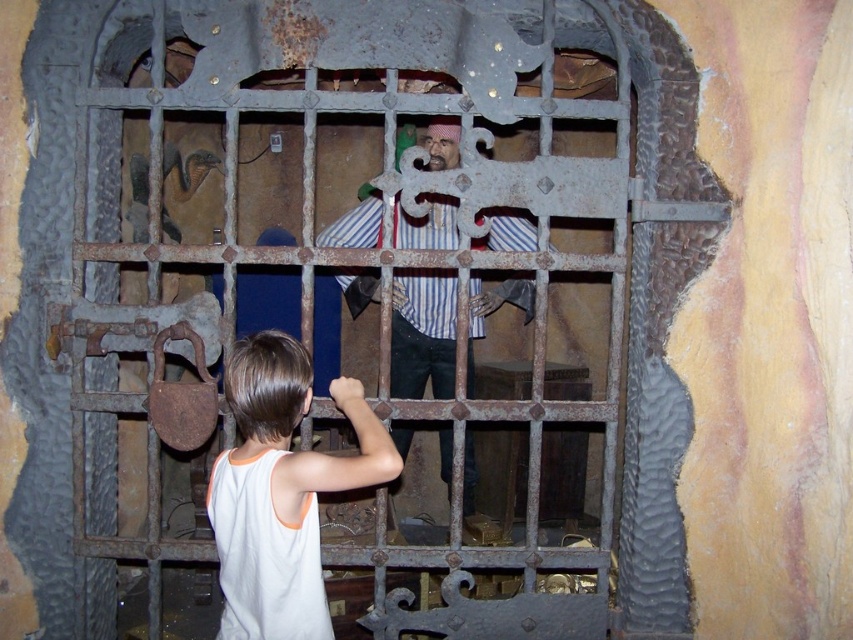
You are a costume designer preparing for a play. You need to place the white cotton tank top at lower left and the striped fabric pirate at center in a display. Based on the scene, which item should be placed lower to avoid blocking the view of the other?

The white cotton tank top at lower left should be placed lower because it is positioned under the striped fabric pirate at center, ensuring it doesn

You are a visitor at this themed exhibit and notice two items in the scene. The first is a white cotton tank top at lower left and the second is a striped fabric pirate at center. Which item is positioned more to the left side of the scene?

The white cotton tank top at lower left is positioned more to the left side of the scene as it is located to the left of the striped fabric pirate at center.